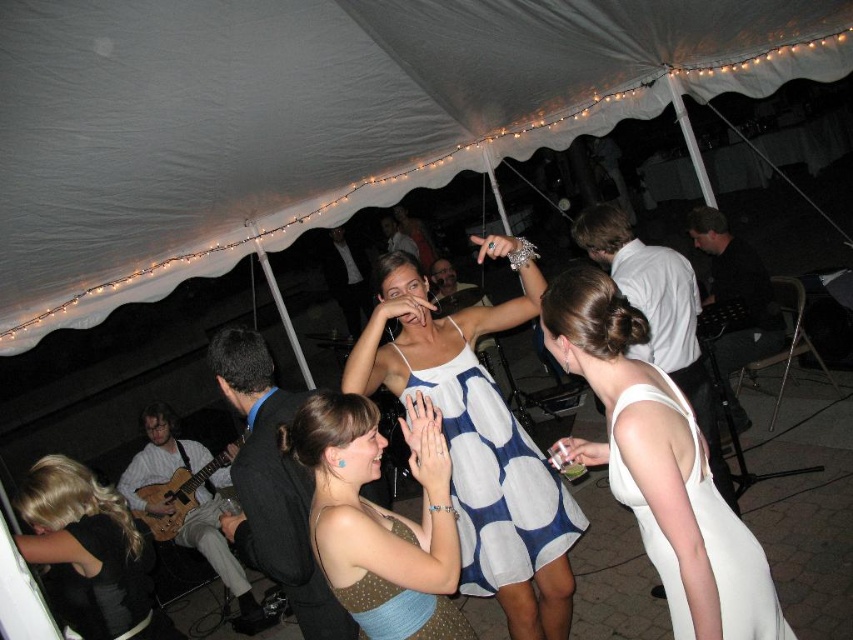
Is point (463, 428) behind point (376, 637)?

Yes, point (463, 428) is farther from viewer.

Between white dotted fabric dress at center and blue dotted fabric dress at center, which one has more height?

Standing taller between the two is white dotted fabric dress at center.

Is point (498, 518) behind point (415, 589)?

That is True.

The width and height of the screenshot is (853, 640). Identify the location of white dotted fabric dress at center. (494, 476).

Between white dotted fabric dress at center and black leather jacket at lower left, which one appears on the left side from the viewer's perspective?

From the viewer's perspective, black leather jacket at lower left appears more on the left side.

Between point (479, 515) and point (91, 508), which one is positioned in front?

Point (91, 508) is more forward.

You are a GUI agent. You are given a task and a screenshot of the screen. Output one action in this format:
    pyautogui.click(x=<x>, y=<y>)
    Task: Click on the white dotted fabric dress at center
    Image resolution: width=853 pixels, height=640 pixels.
    Given the screenshot: What is the action you would take?
    pyautogui.click(x=494, y=476)

How much distance is there between polka dot dress at center and blue dotted fabric dress at center?

2.97 inches

Is polka dot dress at center to the left of blue dotted fabric dress at center from the viewer's perspective?

Correct, you'll find polka dot dress at center to the left of blue dotted fabric dress at center.

What are the coordinates of `polka dot dress at center` in the screenshot? It's located at (380, 518).